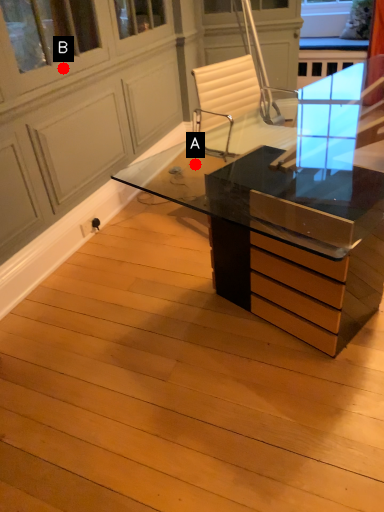
Question: Two points are circled on the image, labeled by A and B beside each circle. Among these points, which one is farthest from the camera?

Choices:
 (A) A is further
 (B) B is further

Answer: (A)